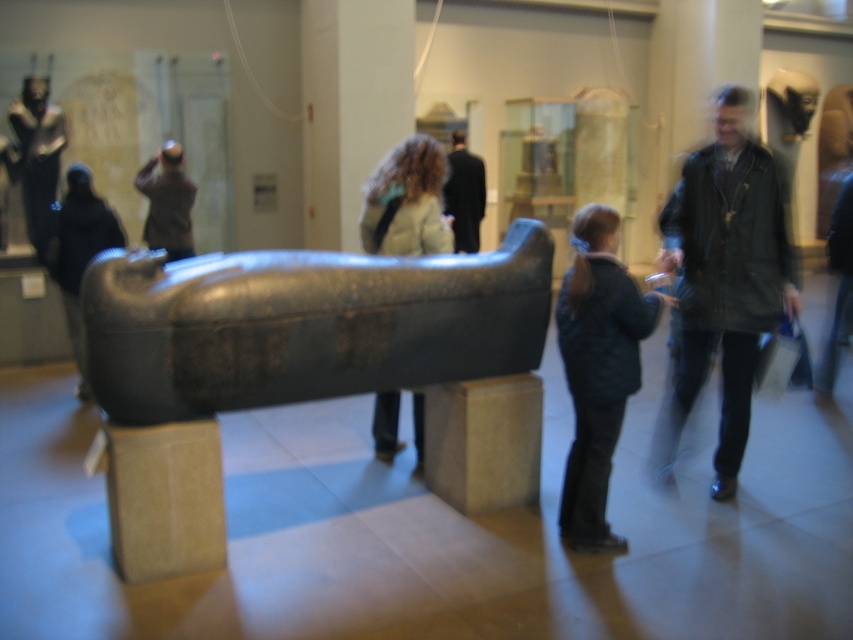
Question: Does dark blue quilted jacket at center come in front of shiny silver statue at upper left?

Choices:
 (A) yes
 (B) no

Answer: (A)

Question: Estimate the real-world distances between objects in this image. Which object is farther from the light brown leather jacket at center?

Choices:
 (A) shiny silver statue at upper left
 (B) dark brown leather jacket at right

Answer: (A)

Question: Which point is farther from the camera taking this photo?

Choices:
 (A) tap(479, 161)
 (B) tap(306, 362)

Answer: (A)

Question: Which point appears closest to the camera in this image?

Choices:
 (A) (468, 188)
 (B) (48, 262)

Answer: (B)

Question: Can you confirm if polished dark gray stone sarcophagus at center is thinner than black fabric headscarf at left?

Choices:
 (A) no
 (B) yes

Answer: (A)

Question: Is polished dark gray stone sarcophagus at center further to the viewer compared to dark brown leather jacket at center?

Choices:
 (A) yes
 (B) no

Answer: (B)